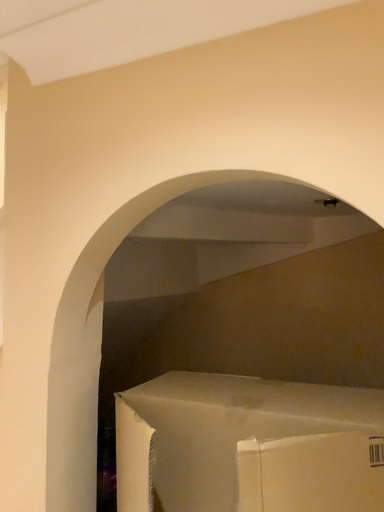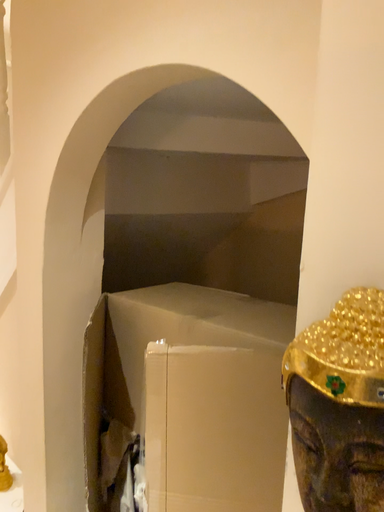
Question: How did the camera likely rotate when shooting the video?

Choices:
 (A) rotated right
 (B) rotated left

Answer: (B)